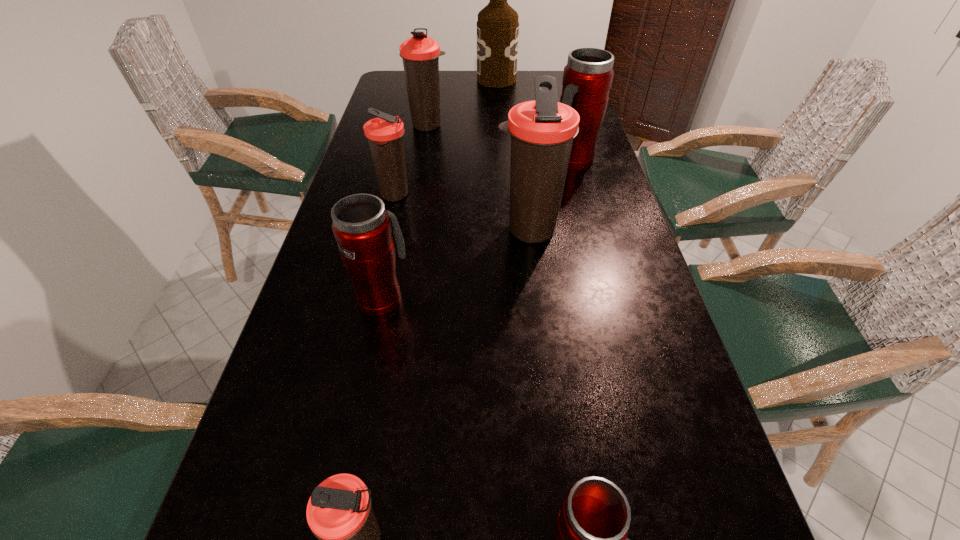
Where is `the fifth farthest thermos bottle`? The image size is (960, 540). the fifth farthest thermos bottle is located at coordinates (362, 227).

Find the location of `the leftmost red thermos bottle`. the leftmost red thermos bottle is located at coordinates (362, 227).

At what (x,y) coordinates should I click in order to perform the action: click on vacant area situated 0.330m on the label of the alcohol. Please return your answer as a coordinate pair (x, y). Looking at the image, I should click on (393, 79).

Where is `vacant space positioned on the label of the alcohol`? Image resolution: width=960 pixels, height=540 pixels. vacant space positioned on the label of the alcohol is located at coordinates (400, 79).

Where is `vacant area situated on the label of the alcohol`? vacant area situated on the label of the alcohol is located at coordinates (444, 79).

Where is `blank space located 0.150m on the left of the fourth nearest thermos bottle`? The image size is (960, 540). blank space located 0.150m on the left of the fourth nearest thermos bottle is located at coordinates (435, 231).

This screenshot has width=960, height=540. I want to click on vacant space situated 0.120m on the front of the farthest brown thermos bottle, so click(x=424, y=154).

The height and width of the screenshot is (540, 960). I want to click on vacant space located 0.230m on the side with the handle of the rightmost red thermos bottle, so click(589, 226).

Identify the location of vacant space situated 0.060m on the left of the third nearest brown thermos bottle. (354, 195).

Image resolution: width=960 pixels, height=540 pixels. In order to click on vacant space situated 0.060m on the side with the handle of the second farthest red thermos bottle in this screenshot , I will do `click(390, 259)`.